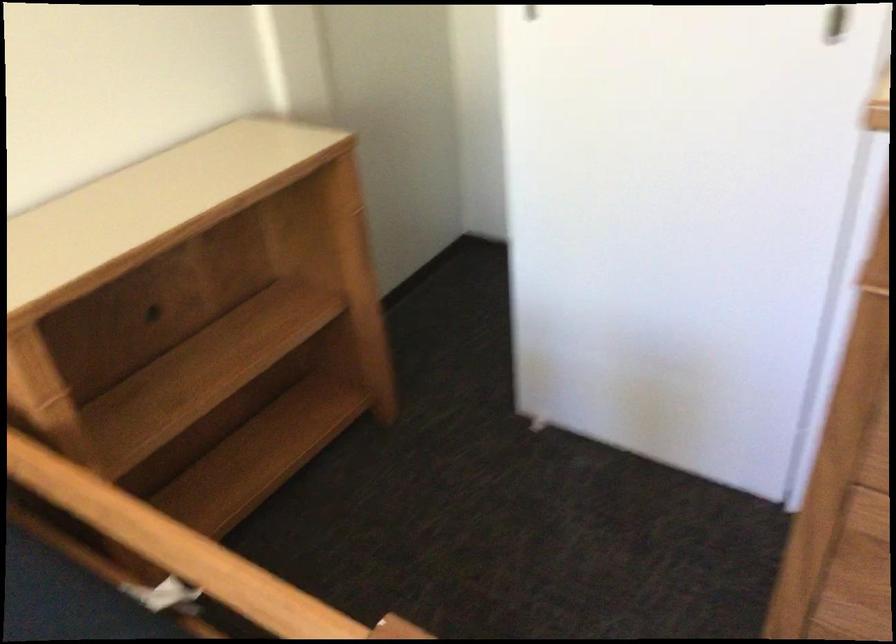
Question: The images are taken continuously from a first-person perspective. In which direction is your viewpoint rotating?

Choices:
 (A) Left
 (B) Right
 (C) Up
 (D) Down

Answer: (B)